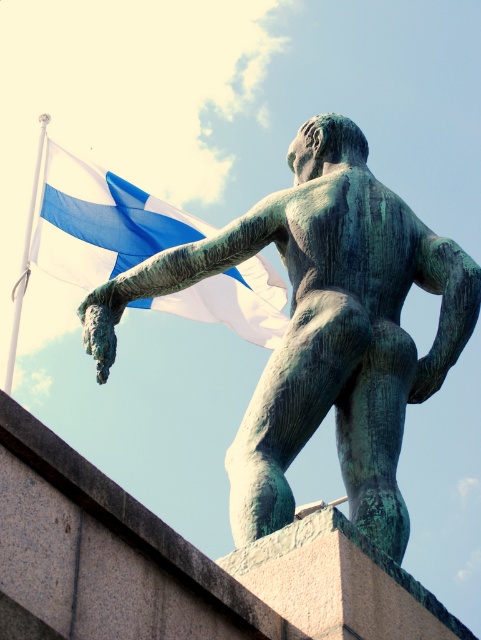
Question: Which point is closer to the camera?

Choices:
 (A) blue fabric flag at upper left
 (B) green patina statue at center

Answer: (B)

Question: Does green patina statue at center have a smaller size compared to blue fabric flag at upper left?

Choices:
 (A) yes
 (B) no

Answer: (A)

Question: Is green patina statue at center above blue fabric flag at upper left?

Choices:
 (A) no
 (B) yes

Answer: (A)

Question: Is green patina statue at center below blue fabric flag at upper left?

Choices:
 (A) no
 (B) yes

Answer: (B)

Question: Which object appears farthest from the camera in this image?

Choices:
 (A) blue fabric flag at upper left
 (B) green patina statue at center

Answer: (A)